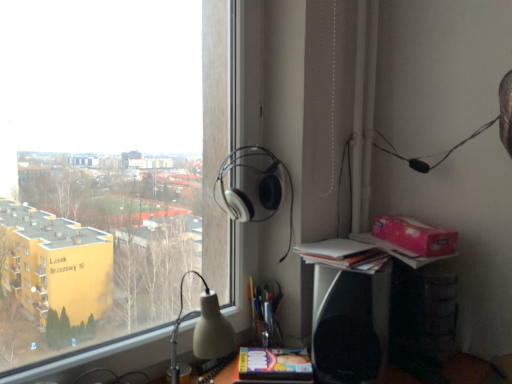
Question: From a real-world perspective, is transparent glass window at upper left beneath black plastic speaker at lower right?

Choices:
 (A) no
 (B) yes

Answer: (A)

Question: Would you say transparent glass window at upper left is a long distance from black plastic speaker at lower right?

Choices:
 (A) no
 (B) yes

Answer: (A)

Question: Can you confirm if transparent glass window at upper left is taller than black plastic speaker at lower right?

Choices:
 (A) no
 (B) yes

Answer: (B)

Question: From a real-world perspective, is transparent glass window at upper left located higher than black plastic speaker at lower right?

Choices:
 (A) yes
 (B) no

Answer: (A)

Question: Is black plastic speaker at lower right surrounded by transparent glass window at upper left?

Choices:
 (A) no
 (B) yes

Answer: (A)

Question: Is transparent glass window at upper left wider than black plastic speaker at lower right?

Choices:
 (A) yes
 (B) no

Answer: (B)

Question: Considering the relative sizes of transparent glass window at upper left and matte yellow paperback book at lower center in the image provided, is transparent glass window at upper left smaller than matte yellow paperback book at lower center?

Choices:
 (A) no
 (B) yes

Answer: (A)

Question: Considering the relative sizes of transparent glass window at upper left and matte yellow paperback book at lower center in the image provided, is transparent glass window at upper left shorter than matte yellow paperback book at lower center?

Choices:
 (A) no
 (B) yes

Answer: (A)

Question: Is transparent glass window at upper left looking in the opposite direction of matte yellow paperback book at lower center?

Choices:
 (A) no
 (B) yes

Answer: (A)

Question: Can we say transparent glass window at upper left lies outside matte yellow paperback book at lower center?

Choices:
 (A) yes
 (B) no

Answer: (A)

Question: Can you confirm if transparent glass window at upper left is wider than matte yellow paperback book at lower center?

Choices:
 (A) no
 (B) yes

Answer: (A)

Question: Is transparent glass window at upper left behind matte yellow paperback book at lower center?

Choices:
 (A) yes
 (B) no

Answer: (B)

Question: Does black plastic speaker at lower right have a larger size compared to white matte headphones at upper center?

Choices:
 (A) yes
 (B) no

Answer: (A)